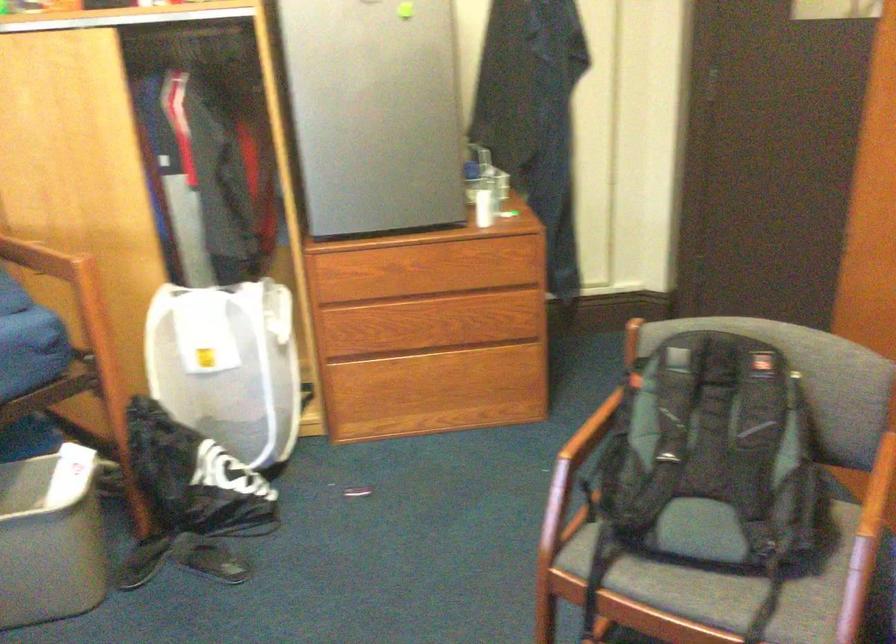
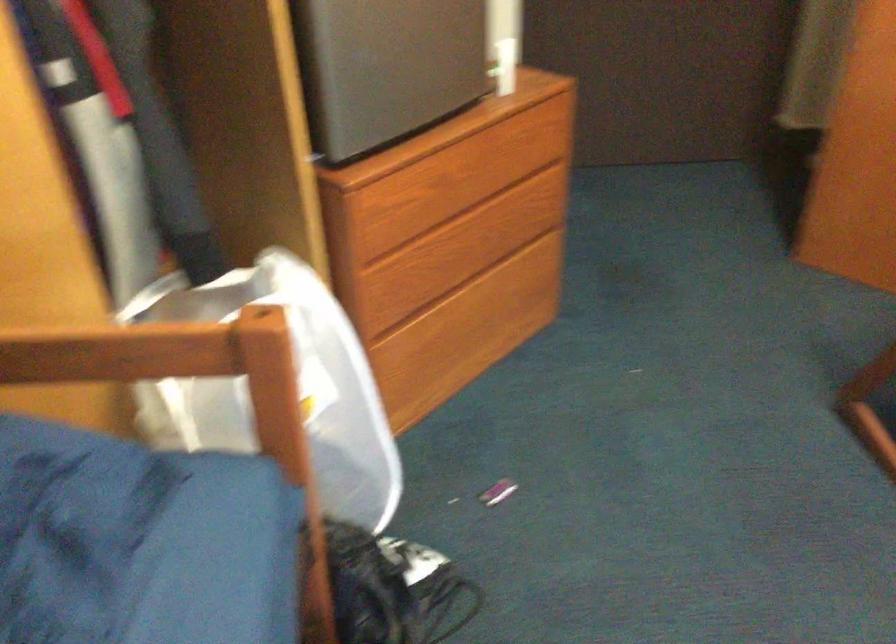
In the second image, find the point that corresponds to pixel 371 500 in the first image.

(497, 491)